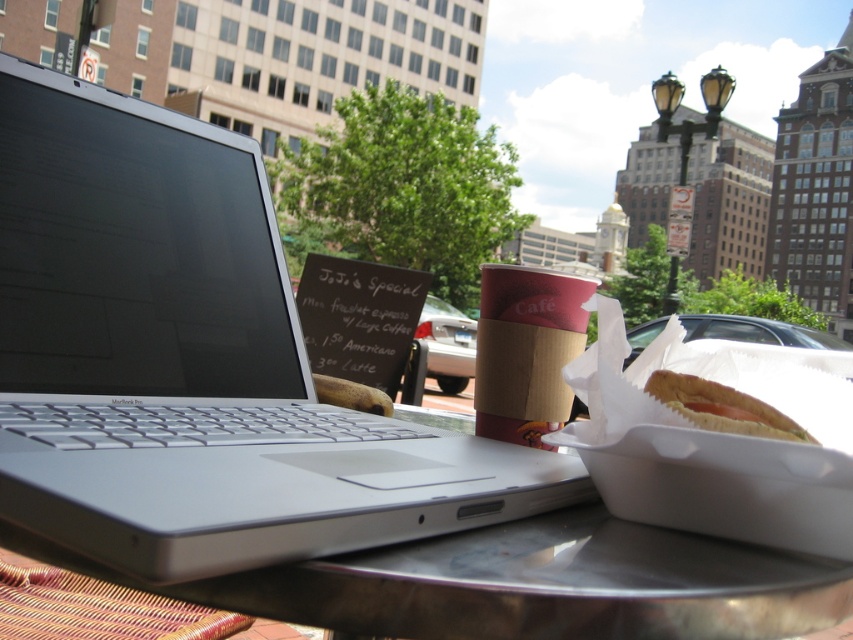
Question: Which of these objects is positioned closest to the metallic silver table at center?

Choices:
 (A) brown paper cup at center
 (B) white paper hot dog at center

Answer: (B)

Question: Can you confirm if silver metallic laptop at center is bigger than white paper hot dog at center?

Choices:
 (A) no
 (B) yes

Answer: (B)

Question: Does metallic silver table at center lie in front of brown paper cup at center?

Choices:
 (A) yes
 (B) no

Answer: (A)

Question: Does metallic silver table at center appear under brown paper cup at center?

Choices:
 (A) yes
 (B) no

Answer: (A)

Question: Based on their relative distances, which object is nearer to the silver metallic laptop at center?

Choices:
 (A) metallic silver table at center
 (B) brown paper cup at center
 (C) white paper hot dog at center

Answer: (A)

Question: Among these points, which one is farthest from the camera?

Choices:
 (A) (656, 625)
 (B) (514, 316)
 (C) (219, 320)

Answer: (B)